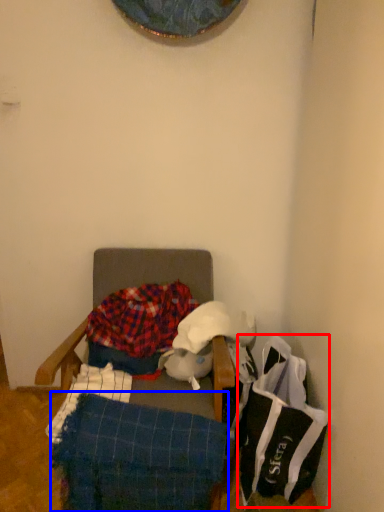
Question: Which of the following is the closest to the observer, material (highlighted by a red box) or blanket (highlighted by a blue box)?

Choices:
 (A) material
 (B) blanket

Answer: (B)